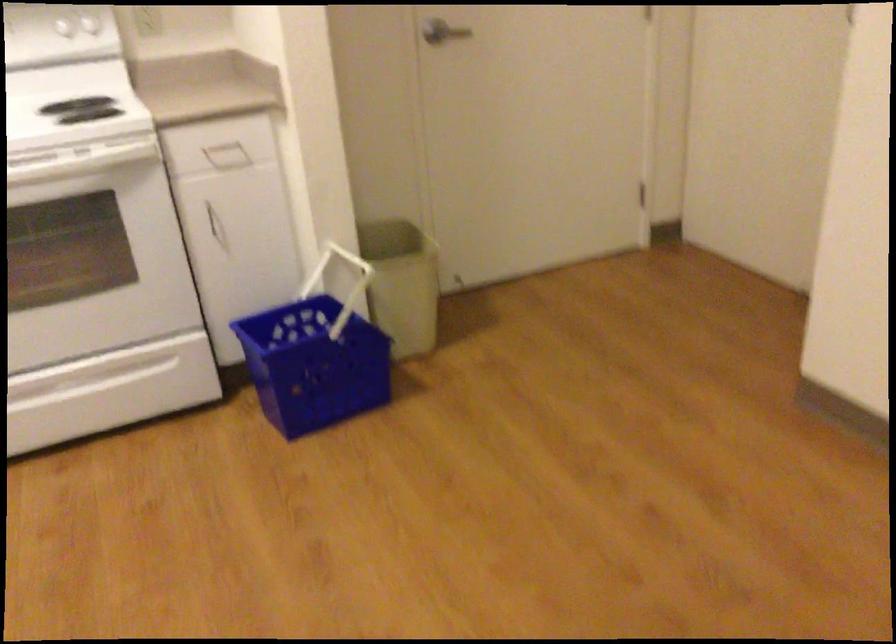
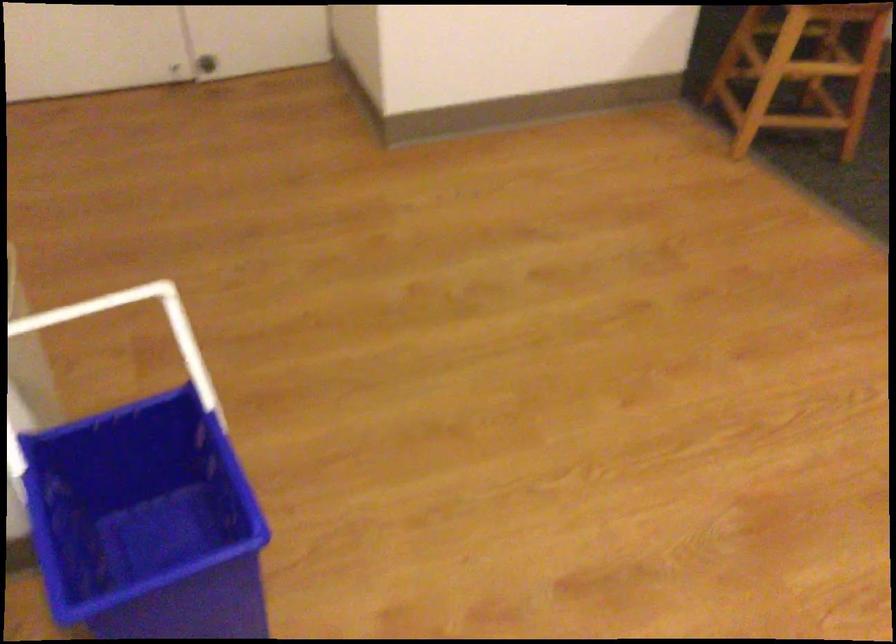
Locate, in the second image, the point that corresponds to point 352,254 in the first image.

(58, 316)